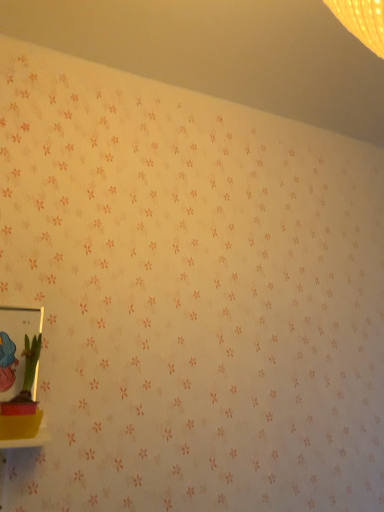
I want to click on green leafy plant at lower left, so click(23, 400).

What do you see at coordinates (23, 400) in the screenshot? The image size is (384, 512). I see `green leafy plant at lower left` at bounding box center [23, 400].

Find the location of a particular element. green leafy plant at lower left is located at coordinates (23, 400).